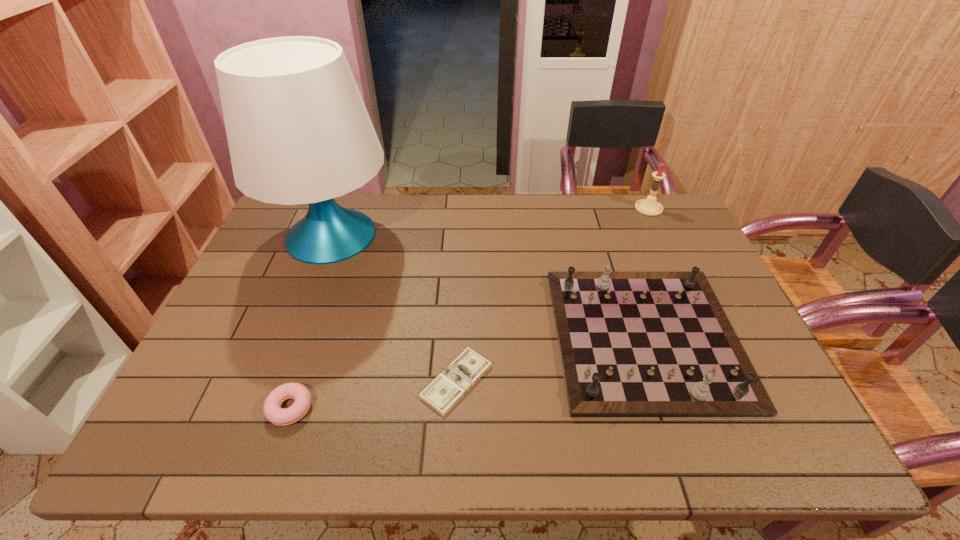
Identify the location of vacant position in the image that satisfies the following two spatial constraints: 1. on the front-facing side of the tallest object; 2. on the back side of the shortest object. (276, 381).

At what (x,y) coordinates should I click in order to perform the action: click on vacant region that satisfies the following two spatial constraints: 1. on the front-facing side of the doughnut; 2. on the right side of the tallest object. Please return your answer as a coordinate pair (x, y). The image size is (960, 540). Looking at the image, I should click on pyautogui.click(x=265, y=408).

Where is `free spot that satisfies the following two spatial constraints: 1. on the back side of the second shortest object; 2. on the front-facing side of the tallest object`? This screenshot has height=540, width=960. free spot that satisfies the following two spatial constraints: 1. on the back side of the second shortest object; 2. on the front-facing side of the tallest object is located at coordinates (348, 235).

I want to click on free point that satisfies the following two spatial constraints: 1. on the front-facing side of the shortest object; 2. on the right side of the table lamp, so coord(276,381).